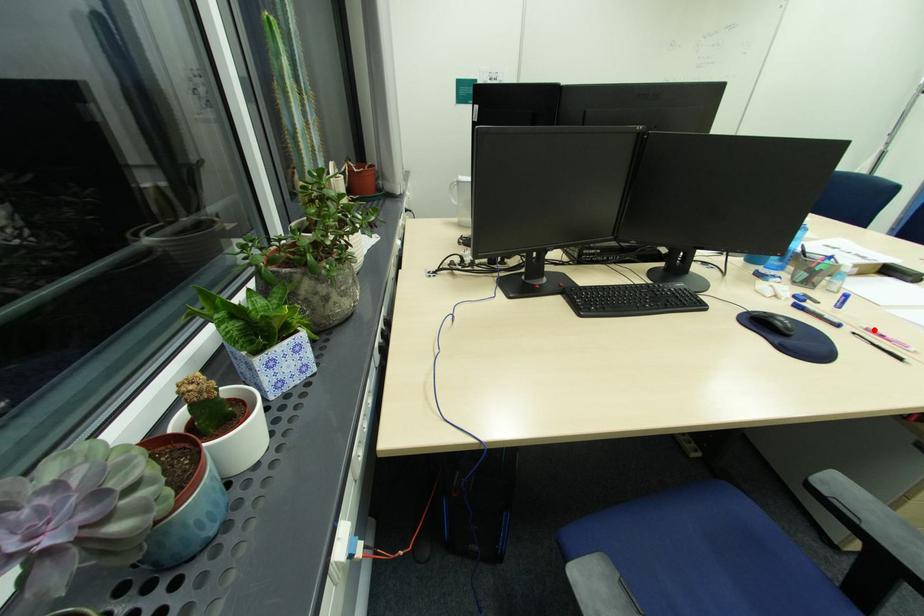
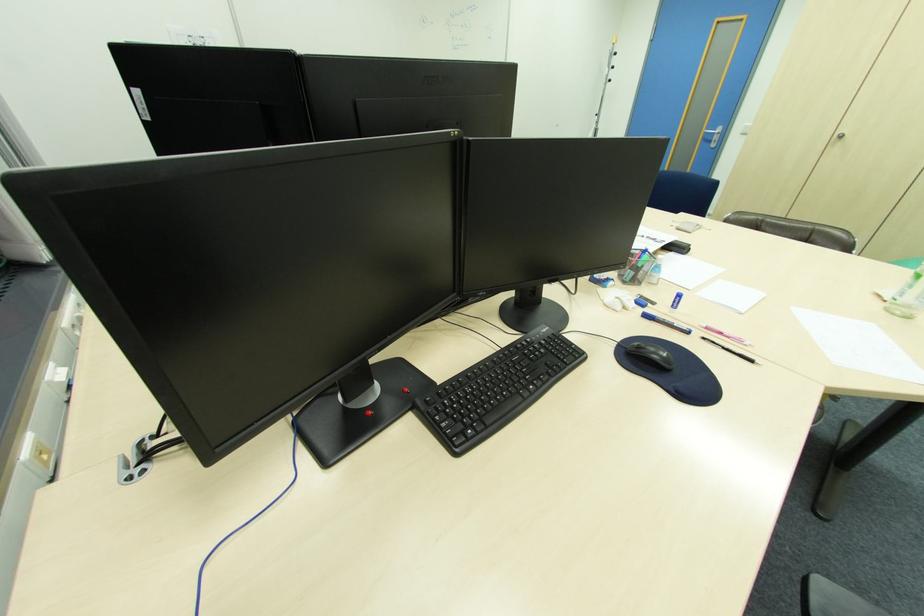
Find the pixel in the second image that matches the highlighted location in the first image.

(712, 328)